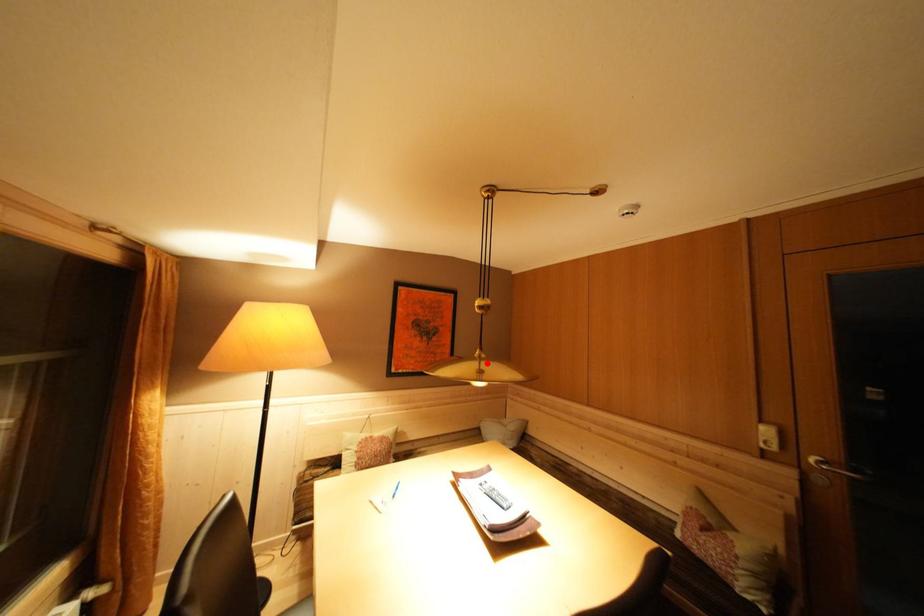
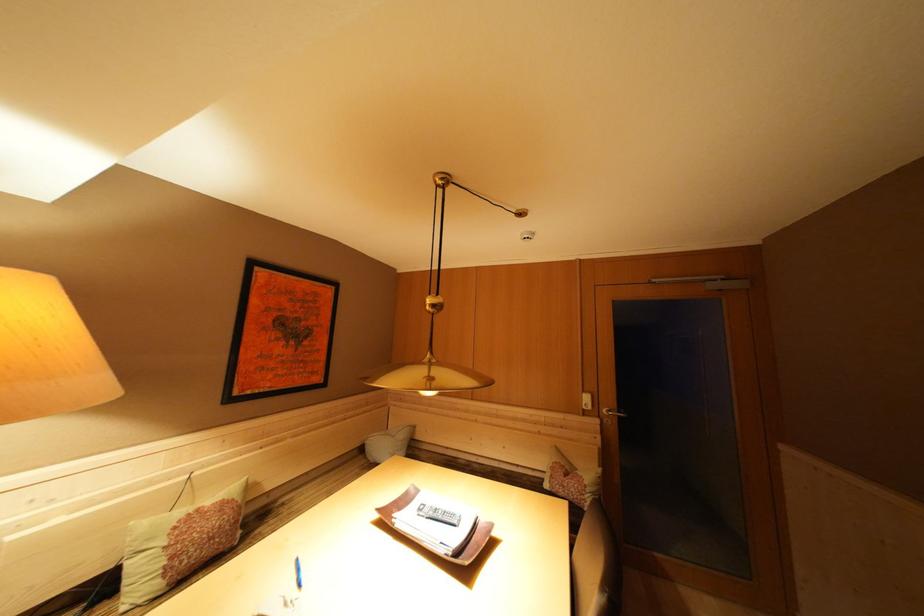
Locate, in the second image, the point that corresponds to the highlighted location in the first image.

(438, 369)